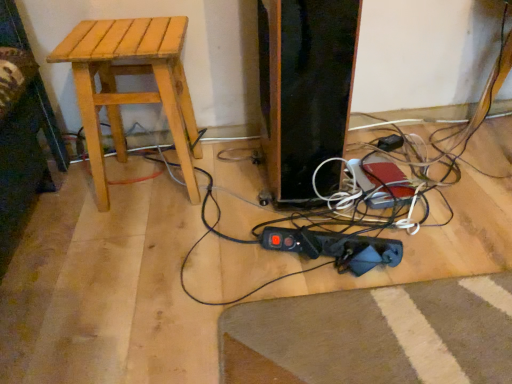
Question: From a real-world perspective, is light brown wood stool at left under black plastic plug at lower right?

Choices:
 (A) yes
 (B) no

Answer: (B)

Question: From a real-world perspective, is light brown wood stool at left positioned over black plastic plug at lower right based on gravity?

Choices:
 (A) yes
 (B) no

Answer: (A)

Question: Can you confirm if light brown wood stool at left is positioned to the left of black plastic plug at lower right?

Choices:
 (A) yes
 (B) no

Answer: (A)

Question: Does light brown wood stool at left have a lesser height compared to black plastic plug at lower right?

Choices:
 (A) yes
 (B) no

Answer: (B)

Question: Is light brown wood stool at left surrounding black plastic plug at lower right?

Choices:
 (A) no
 (B) yes

Answer: (A)

Question: Would you consider light brown wood stool at left to be distant from black plastic plug at lower right?

Choices:
 (A) yes
 (B) no

Answer: (B)

Question: Is the position of black plastic plug at lower right more distant than that of light brown wood stool at left?

Choices:
 (A) no
 (B) yes

Answer: (B)

Question: Is black plastic plug at lower right thinner than light brown wood stool at left?

Choices:
 (A) yes
 (B) no

Answer: (A)

Question: Can you confirm if black plastic plug at lower right is positioned to the right of light brown wood stool at left?

Choices:
 (A) yes
 (B) no

Answer: (A)

Question: From the image's perspective, is black plastic plug at lower right below light brown wood stool at left?

Choices:
 (A) no
 (B) yes

Answer: (B)

Question: Considering the relative sizes of black plastic plug at lower right and light brown wood stool at left in the image provided, is black plastic plug at lower right taller than light brown wood stool at left?

Choices:
 (A) no
 (B) yes

Answer: (A)

Question: Is black plastic plug at lower right facing away from light brown wood stool at left?

Choices:
 (A) yes
 (B) no

Answer: (B)

Question: Considering the positions of point (399, 144) and point (168, 109), is point (399, 144) closer or farther from the camera than point (168, 109)?

Choices:
 (A) closer
 (B) farther

Answer: (B)